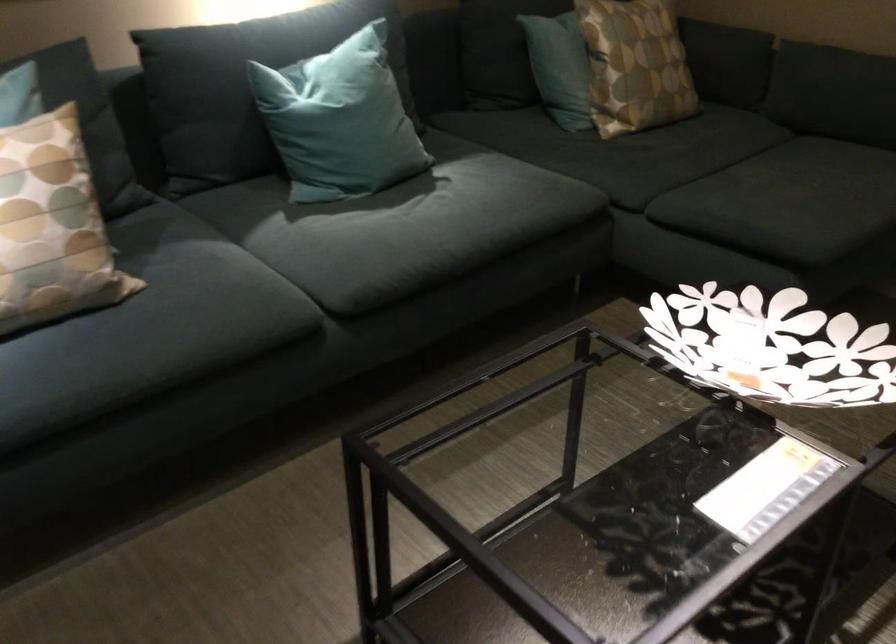
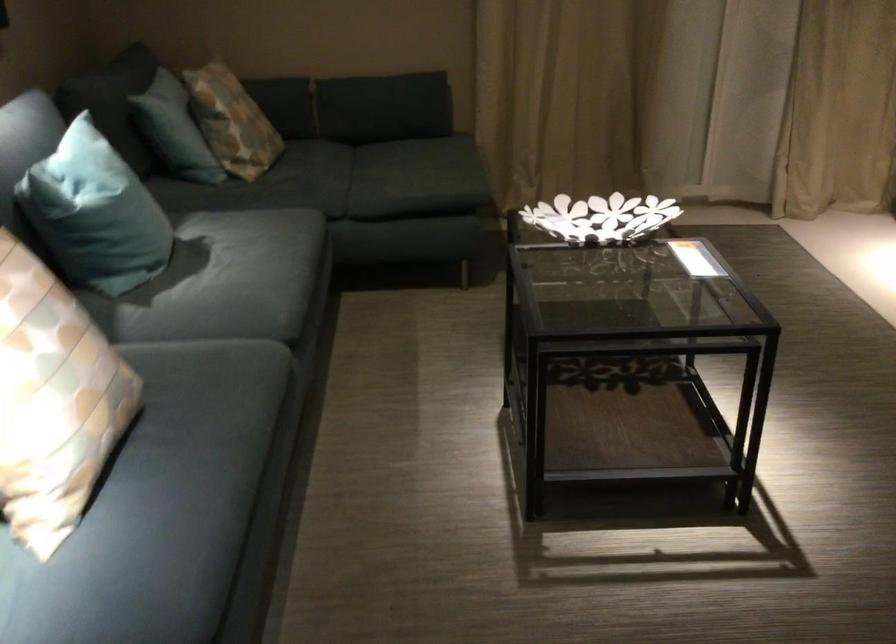
In the second image, find the point that corresponds to point (295, 109) in the first image.

(95, 214)